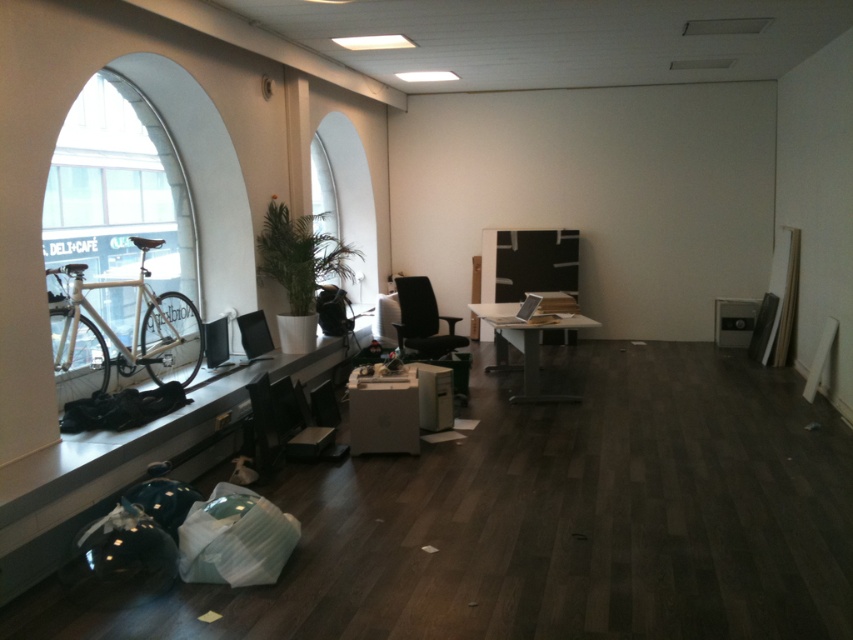
Between transparent glass window at left and black glossy monitor at left, which one appears on the left side from the viewer's perspective?

Positioned to the left is transparent glass window at left.

Does transparent glass window at left have a lesser width compared to black glossy monitor at left?

In fact, transparent glass window at left might be wider than black glossy monitor at left.

Which is in front, point (173, 173) or point (248, 337)?

Point (248, 337) is in front.

The image size is (853, 640). I want to click on transparent glass window at left, so click(x=119, y=188).

Consider the image. Which of these two, transparent glass window at left or white glossy table at center, stands shorter?

white glossy table at center

Locate an element on the screen. The width and height of the screenshot is (853, 640). transparent glass window at left is located at coordinates (119, 188).

The height and width of the screenshot is (640, 853). What do you see at coordinates (428, 332) in the screenshot?
I see `black leather chair at center` at bounding box center [428, 332].

Which of these two, black leather chair at center or black plastic chair at center, stands taller?

black leather chair at center is taller.

Is point (456, 337) in front of point (341, 330)?

Yes, it is.

Identify the location of black leather chair at center. (428, 332).